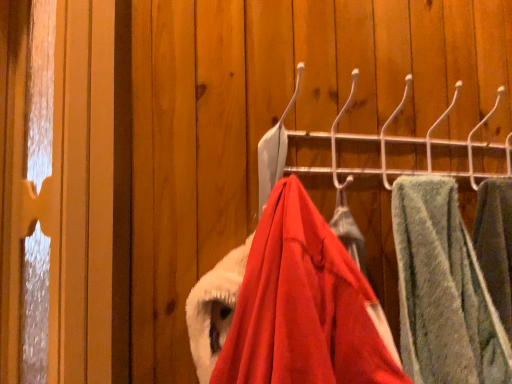
Question: Is velvet red coat at center, the 1th closet positioned from the bottom, further to camera compared to metallic hook rack at center, which ranks as the 1th closet in top-to-bottom order?

Choices:
 (A) no
 (B) yes

Answer: (A)

Question: Does velvet red coat at center, which is the 2th closet in top-to-bottom order, contain metallic hook rack at center, which ranks as the second closet in bottom-to-top order?

Choices:
 (A) yes
 (B) no

Answer: (B)

Question: Is velvet red coat at center, the 1th closet positioned from the bottom, positioned with its back to metallic hook rack at center, which ranks as the second closet in bottom-to-top order?

Choices:
 (A) no
 (B) yes

Answer: (A)

Question: Is velvet red coat at center, the 1th closet positioned from the bottom, at the left side of metallic hook rack at center, which ranks as the second closet in bottom-to-top order?

Choices:
 (A) yes
 (B) no

Answer: (A)

Question: From a real-world perspective, is velvet red coat at center, the 1th closet positioned from the bottom, beneath metallic hook rack at center, which ranks as the 1th closet in top-to-bottom order?

Choices:
 (A) no
 (B) yes

Answer: (B)

Question: Is point (205, 135) positioned closer to the camera than point (453, 172)?

Choices:
 (A) farther
 (B) closer

Answer: (B)

Question: Considering the relative positions of velvet red coat at center, which is the 2th closet in top-to-bottom order, and metallic hook rack at center, which ranks as the 1th closet in top-to-bottom order, in the image provided, is velvet red coat at center, which is the 2th closet in top-to-bottom order, to the left or to the right of metallic hook rack at center, which ranks as the 1th closet in top-to-bottom order,?

Choices:
 (A) left
 (B) right

Answer: (A)

Question: In terms of width, does velvet red coat at center, the 1th closet positioned from the bottom, look wider or thinner when compared to metallic hook rack at center, which ranks as the second closet in bottom-to-top order?

Choices:
 (A) thin
 (B) wide

Answer: (B)

Question: From a real-world perspective, is velvet red coat at center, the 1th closet positioned from the bottom, positioned above or below metallic hook rack at center, which ranks as the second closet in bottom-to-top order?

Choices:
 (A) below
 (B) above

Answer: (A)

Question: In the image, is metallic hook rack at center, which ranks as the second closet in bottom-to-top order, on the left side or the right side of green fuzzy towel at right?

Choices:
 (A) left
 (B) right

Answer: (A)

Question: From the image's perspective, is metallic hook rack at center, which ranks as the 1th closet in top-to-bottom order, above or below green fuzzy towel at right?

Choices:
 (A) above
 (B) below

Answer: (A)

Question: From a real-world perspective, is metallic hook rack at center, which ranks as the second closet in bottom-to-top order, above or below green fuzzy towel at right?

Choices:
 (A) below
 (B) above

Answer: (B)

Question: Do you think metallic hook rack at center, which ranks as the 1th closet in top-to-bottom order, is within green fuzzy towel at right, or outside of it?

Choices:
 (A) inside
 (B) outside

Answer: (B)

Question: Does point (381, 173) appear closer or farther from the camera than point (220, 196)?

Choices:
 (A) closer
 (B) farther

Answer: (B)

Question: Is metallic hook rack at center, which ranks as the second closet in bottom-to-top order, wider or thinner than velvet red coat at center, which is the 2th closet in top-to-bottom order?

Choices:
 (A) thin
 (B) wide

Answer: (A)